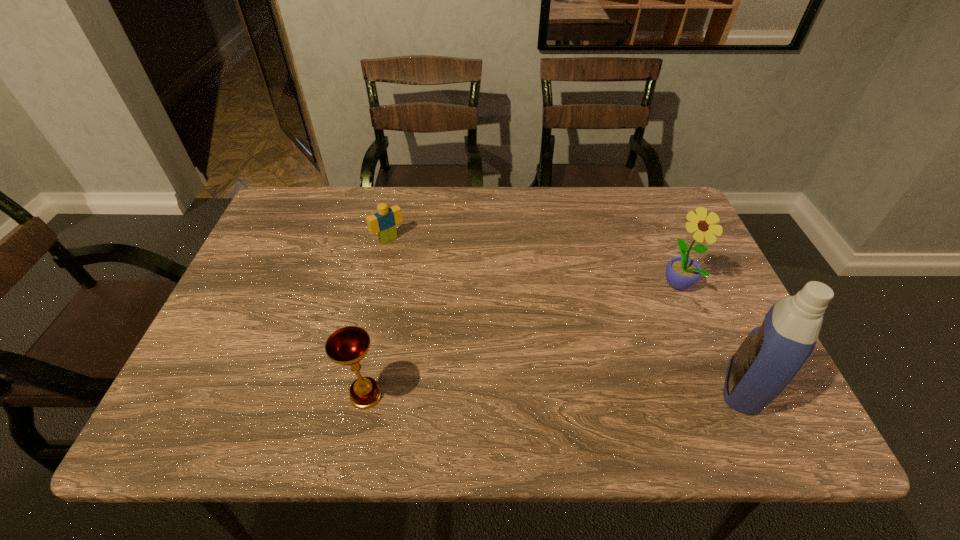
Where is `chalice`? chalice is located at coordinates (346, 346).

You are a GUI agent. You are given a task and a screenshot of the screen. Output one action in this format:
    pyautogui.click(x=<x>, y=<y>)
    Task: Click on the tallest object
    This screenshot has width=960, height=540.
    Given the screenshot: What is the action you would take?
    pyautogui.click(x=772, y=354)

In order to click on the farthest object in this screenshot , I will do `click(384, 222)`.

Locate an element on the screen. The height and width of the screenshot is (540, 960). Lego is located at coordinates (384, 222).

Locate an element on the screen. the second farthest object is located at coordinates (682, 273).

Find the location of a particular element. Image resolution: width=960 pixels, height=540 pixels. sunflower is located at coordinates (682, 273).

At what (x,y) coordinates should I click in order to perform the action: click on vacant space situated 0.320m on the left of the third tallest object. Please return your answer as a coordinate pair (x, y). Looking at the image, I should click on (191, 396).

Where is `vacant point located 0.090m on the left of the tallest object`? vacant point located 0.090m on the left of the tallest object is located at coordinates (672, 387).

Identify the location of free space located 0.360m on the face of the Lego. (471, 330).

Where is `free space located 0.300m on the face of the Lego`? This screenshot has width=960, height=540. free space located 0.300m on the face of the Lego is located at coordinates (457, 314).